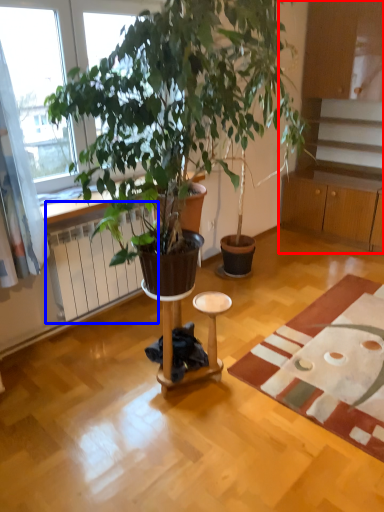
Question: Which of the following is the farthest to the observer, cabinetry (highlighted by a red box) or radiator (highlighted by a blue box)?

Choices:
 (A) cabinetry
 (B) radiator

Answer: (A)